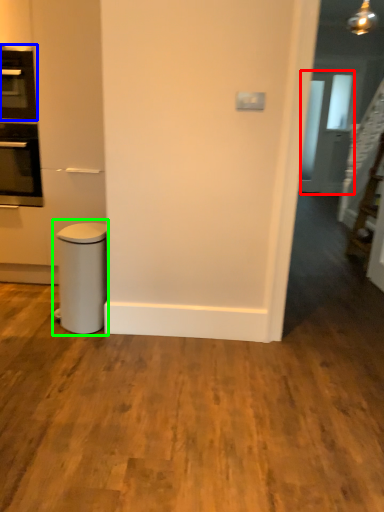
Question: Which object is positioned closest to glass door (highlighted by a red box)? Select from home appliance (highlighted by a blue box) and waste container (highlighted by a green box).

Choices:
 (A) home appliance
 (B) waste container

Answer: (A)